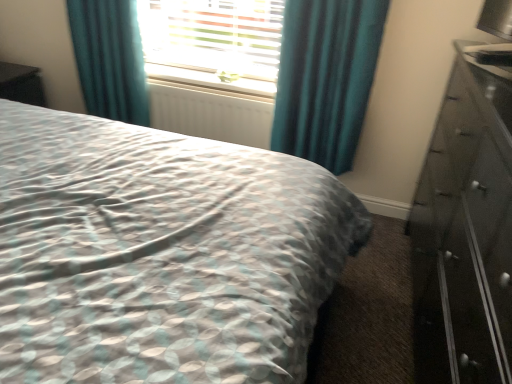
Question: Which is correct: black glossy vanity at left is inside teal velvet curtain at upper left, the 1th curtain in the left-to-right sequence, or outside of it?

Choices:
 (A) outside
 (B) inside

Answer: (A)

Question: From the image's perspective, relative to teal velvet curtain at upper left, the second curtain from the right, is black glossy vanity at left above or below?

Choices:
 (A) below
 (B) above

Answer: (A)

Question: Estimate the real-world distances between objects in this image. Which object is farther from the teal fabric curtain at upper center, the 2th curtain in the left-to-right sequence?

Choices:
 (A) white textured radiator at center
 (B) white plastic window sill at center
 (C) teal velvet curtain at upper left, the 1th curtain in the left-to-right sequence
 (D) patterned fabric bed at center
 (E) black glossy vanity at left

Answer: (E)

Question: Which object is the closest to the black glossy chest of drawers at right?

Choices:
 (A) white textured radiator at center
 (B) patterned fabric bed at center
 (C) teal velvet curtain at upper left, the second curtain from the right
 (D) white plastic window sill at center
 (E) black glossy vanity at left

Answer: (B)